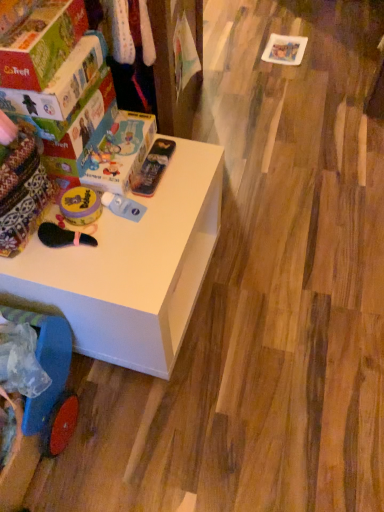
Question: Is blue plastic baby carriage at lower left a part of metallic blue pencil case at upper center, the third toy from the left?

Choices:
 (A) no
 (B) yes

Answer: (A)

Question: Does metallic blue pencil case at upper center, which is the 1th toy in right-to-left order, appear on the right side of blue plastic baby carriage at lower left?

Choices:
 (A) yes
 (B) no

Answer: (A)

Question: Is metallic blue pencil case at upper center, which is the 1th toy in right-to-left order, at the left side of blue plastic baby carriage at lower left?

Choices:
 (A) no
 (B) yes

Answer: (A)

Question: From the image's perspective, is metallic blue pencil case at upper center, which is the 1th toy in right-to-left order, located beneath blue plastic baby carriage at lower left?

Choices:
 (A) no
 (B) yes

Answer: (A)

Question: Does metallic blue pencil case at upper center, the third toy from the left, have a greater height compared to blue plastic baby carriage at lower left?

Choices:
 (A) no
 (B) yes

Answer: (A)

Question: Would you say yellow matte container at left, the first toy in the left-to-right sequence, is inside or outside white matte table at upper left?

Choices:
 (A) inside
 (B) outside

Answer: (B)

Question: Visually, is yellow matte container at left, the first toy in the left-to-right sequence, positioned to the left or to the right of white matte table at upper left?

Choices:
 (A) left
 (B) right

Answer: (A)

Question: Considering the positions of point (89, 219) and point (69, 305), is point (89, 219) closer or farther from the camera than point (69, 305)?

Choices:
 (A) farther
 (B) closer

Answer: (A)

Question: Is yellow matte container at left, the first toy in the left-to-right sequence, taller or shorter than white matte table at upper left?

Choices:
 (A) short
 (B) tall

Answer: (A)

Question: Is yellow matte bubble container at center, which is the 2th toy in right-to-left order, wider or thinner than matte cardboard box at upper left, the 2th box positioned from the back?

Choices:
 (A) wide
 (B) thin

Answer: (B)

Question: Visually, is yellow matte bubble container at center, acting as the 2th toy starting from the left, positioned to the left or to the right of matte cardboard box at upper left, the 2th box positioned from the back?

Choices:
 (A) left
 (B) right

Answer: (B)

Question: Which is correct: yellow matte bubble container at center, acting as the 2th toy starting from the left, is inside matte cardboard box at upper left, the 2th box positioned from the back, or outside of it?

Choices:
 (A) outside
 (B) inside

Answer: (A)

Question: From the image's perspective, is yellow matte bubble container at center, acting as the 2th toy starting from the left, positioned above or below matte cardboard box at upper left, the 2th box positioned from the back?

Choices:
 (A) below
 (B) above

Answer: (A)

Question: Does point (29, 76) appear closer or farther from the camera than point (172, 344)?

Choices:
 (A) farther
 (B) closer

Answer: (B)

Question: Would you say matte cardboard box at upper left, the 2th box positioned from the back, is inside or outside white matte table at upper left?

Choices:
 (A) outside
 (B) inside

Answer: (A)